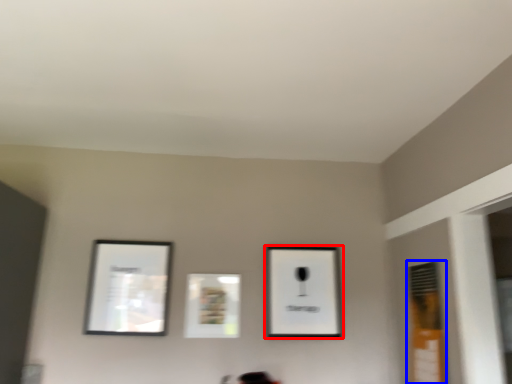
Question: Which object appears farthest to the camera in this image, picture frame (highlighted by a red box) or window (highlighted by a blue box)?

Choices:
 (A) picture frame
 (B) window

Answer: (A)